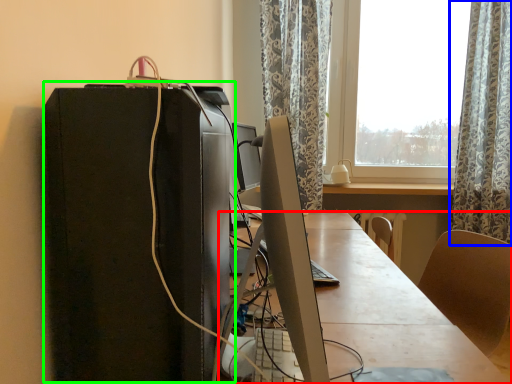
Question: Estimate the real-world distances between objects in this image. Which object is closer to desk (highlighted by a red box), curtain (highlighted by a blue box) or computer tower (highlighted by a green box)?

Choices:
 (A) curtain
 (B) computer tower

Answer: (B)